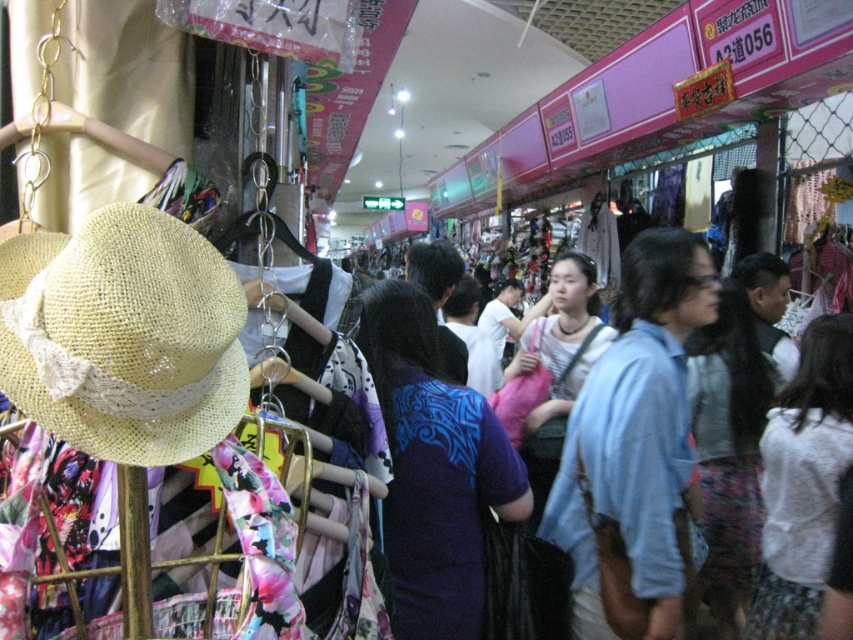
You are standing in the market and want to reach a specific location marked by the point at coordinates (389, 429). If your current distance to this point is 1.94 meters, and you can move in a straight line, will you be able to reach it without any obstacles?

The point at coordinates (389, 429) is 1.94 meters away from you, so yes, you can reach it in a straight line if there are no obstacles between you and the point.

You are standing in the middle of the store and want to grab the white cotton sweater at center. Which direction should you move to reach it?

The white cotton sweater at center is located at point coordinates of (804, 481), so you should move forward and to the right to reach it.